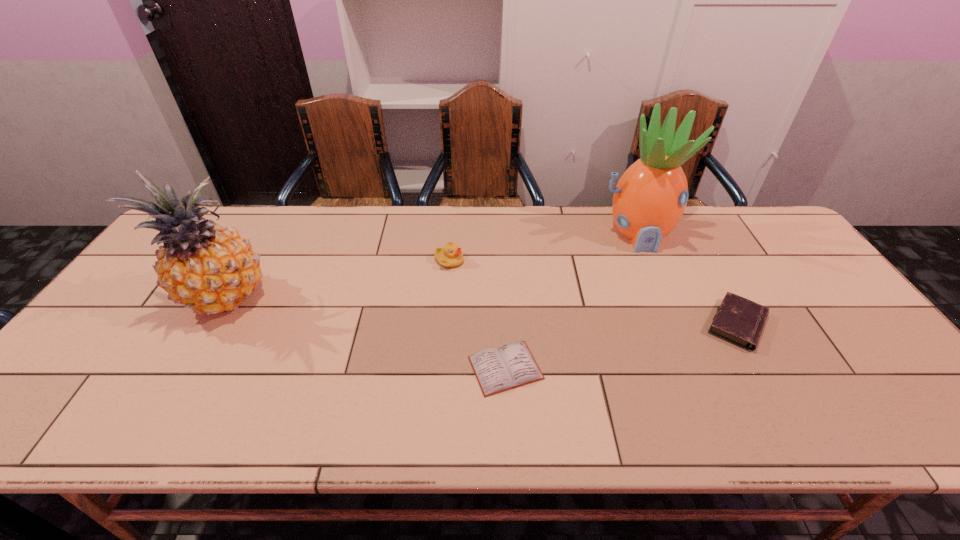
Find the location of a particular element. The width and height of the screenshot is (960, 540). vacant region at the near right corner of the desktop is located at coordinates (865, 418).

At what (x,y) coordinates should I click in order to perform the action: click on empty space between the taller diary and the nearer pineapple. Please return your answer as a coordinate pair (x, y). The width and height of the screenshot is (960, 540). Looking at the image, I should click on (481, 313).

Identify the location of vacant point located between the right pineapple and the shortest object. This screenshot has height=540, width=960. (571, 300).

This screenshot has height=540, width=960. I want to click on vacant space in between the shortest object and the right diary, so click(x=621, y=346).

Identify the location of unoccupied position between the left pineapple and the third object from left to right. (365, 334).

Locate an element on the screen. free spot between the right pineapple and the right diary is located at coordinates (686, 279).

This screenshot has width=960, height=540. I want to click on vacant space that's between the shorter diary and the nearer pineapple, so [365, 334].

Locate an element on the screen. The width and height of the screenshot is (960, 540). free space between the taller diary and the fourth object from right to left is located at coordinates (593, 293).

You are a GUI agent. You are given a task and a screenshot of the screen. Output one action in this format:
    pyautogui.click(x=<x>, y=<y>)
    Task: Click on the vacant space in between the right diary and the left pineapple
    The width and height of the screenshot is (960, 540).
    Given the screenshot: What is the action you would take?
    pyautogui.click(x=481, y=313)

The width and height of the screenshot is (960, 540). Identify the location of unoccupied area between the left pineapple and the farther pineapple. (431, 267).